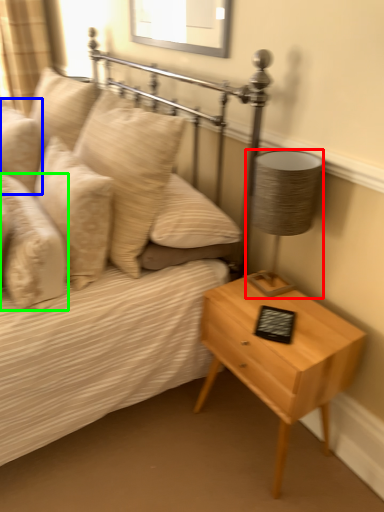
Question: Which object is the farthest from lamp (highlighted by a red box)? Choose among these: pillow (highlighted by a blue box) or pillow (highlighted by a green box).

Choices:
 (A) pillow
 (B) pillow

Answer: (A)